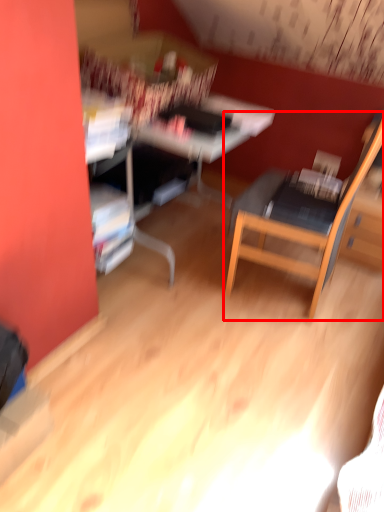
Question: From the image's perspective, where is chair (annotated by the red box) located in relation to computer desk in the image?

Choices:
 (A) above
 (B) below

Answer: (B)